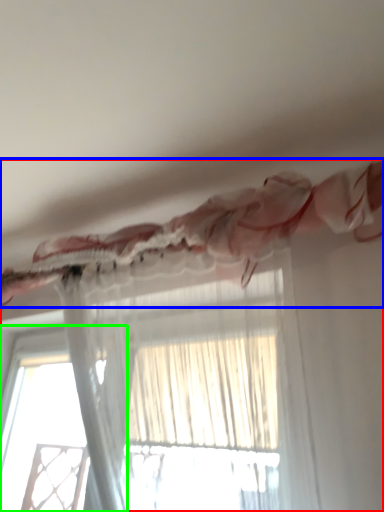
Question: Which object is positioned farthest from curtain (highlighted by a red box)? Select from curtain (highlighted by a blue box) and window (highlighted by a green box).

Choices:
 (A) curtain
 (B) window

Answer: (B)